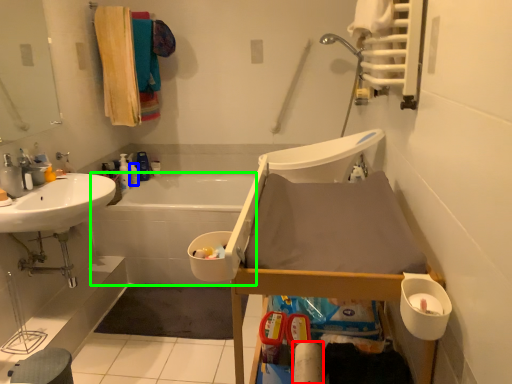
Question: Which object is positioned farthest from toilet paper (highlighted by a red box)? Select from toiletry (highlighted by a blue box) and bath (highlighted by a green box).

Choices:
 (A) toiletry
 (B) bath

Answer: (A)